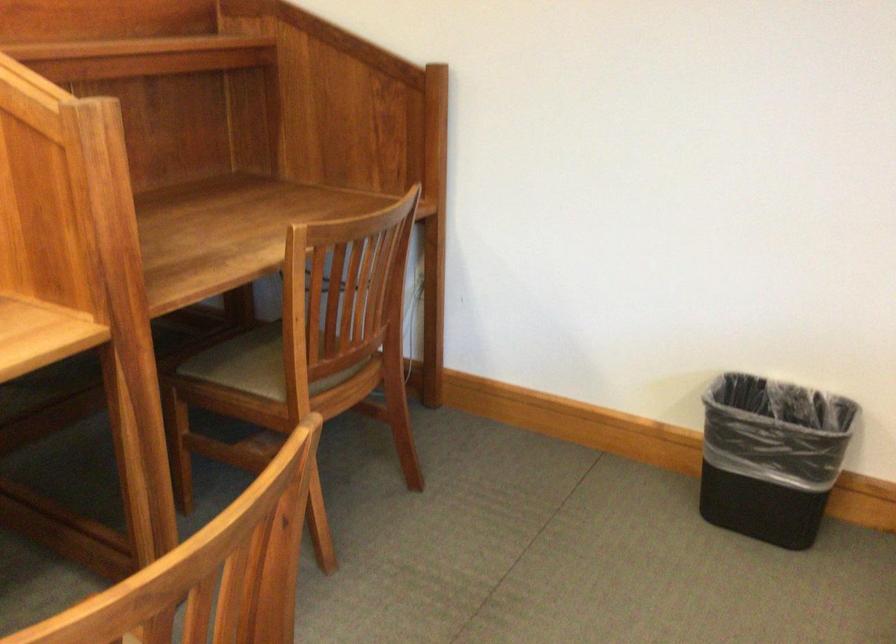
What do you see at coordinates (254, 351) in the screenshot? I see `the chair sitting surface` at bounding box center [254, 351].